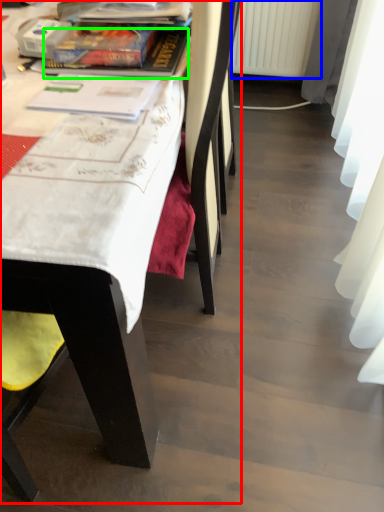
Question: Which object is the farthest from chair (highlighted by a red box)? Choose among these: radiator (highlighted by a blue box) or book (highlighted by a green box).

Choices:
 (A) radiator
 (B) book

Answer: (A)